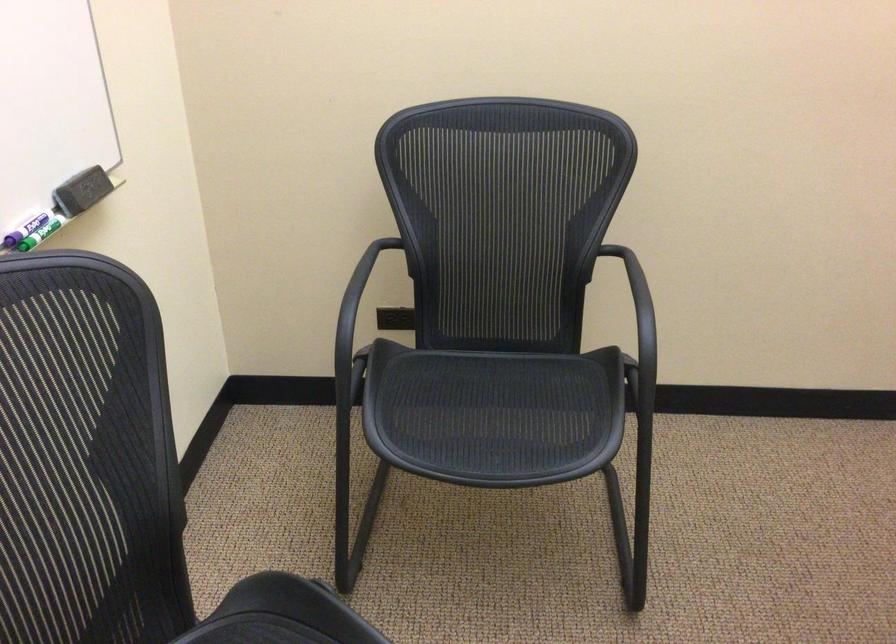
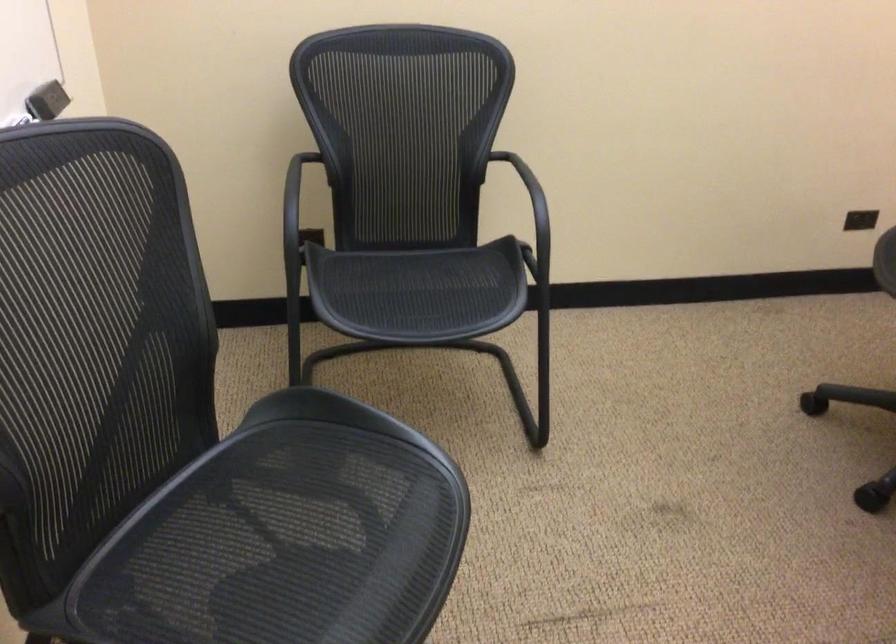
Question: I am providing you with two images of the same scene from different viewpoints. After the viewpoint changes to image2, which objects are now occluded?

Choices:
 (A) black chair armrest
 (B) small black object
 (C) chair armrest
 (D) yellow cloth

Answer: (A)